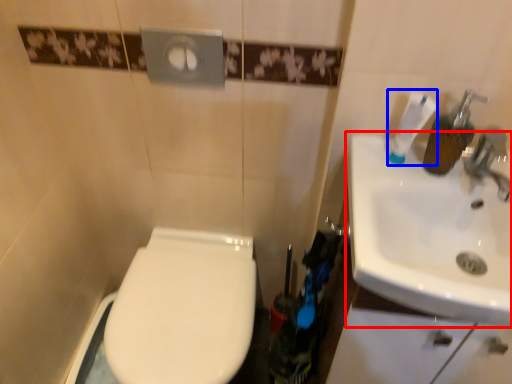
Question: Which of the following is the farthest to the observer, sink (highlighted by a red box) or toothpaste (highlighted by a blue box)?

Choices:
 (A) sink
 (B) toothpaste

Answer: (B)